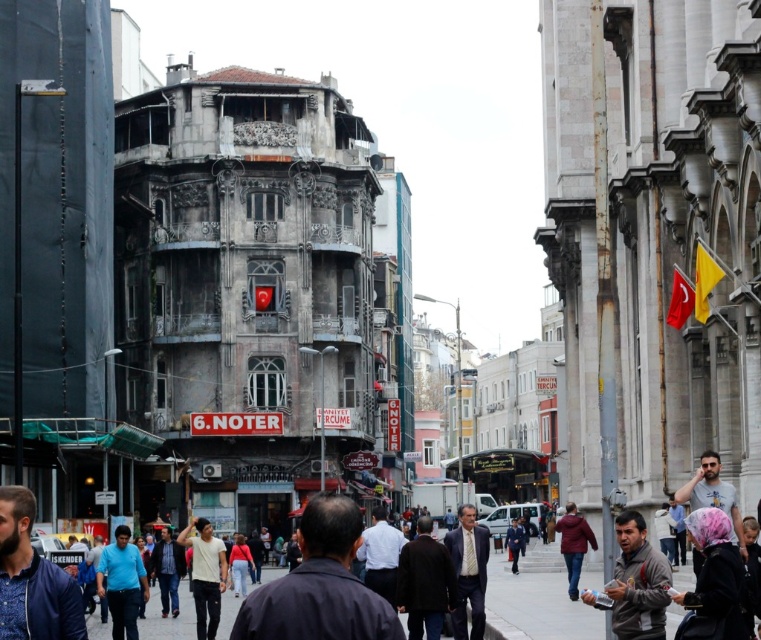
What is the location of the point with coordinates (123, 582) in the image?

The point with coordinates (123, 582) is located on the blue shirt at center.